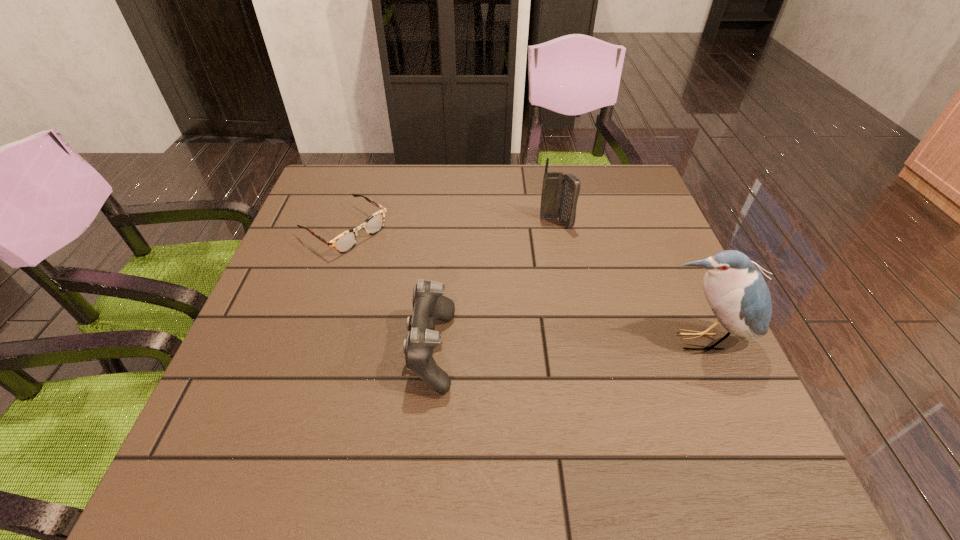
Identify the location of the closest object to the leftmost object. Image resolution: width=960 pixels, height=540 pixels. [x=429, y=304].

Identify which object is located as the third nearest to the tallest object. Please provide its 2D coordinates. Your answer should be formatted as a tuple, i.e. [(x, y)], where the tuple contains the x and y coordinates of a point satisfying the conditions above.

[(346, 241)]